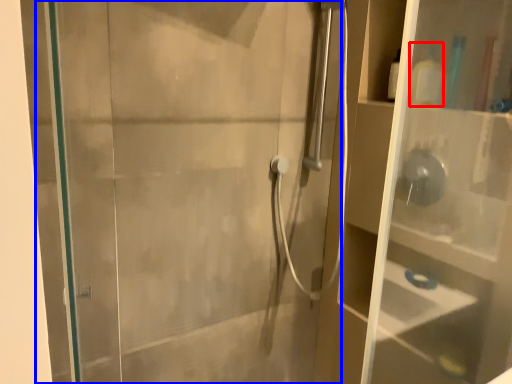
Question: Which object appears closest to the camera in this image, toiletry (highlighted by a red box) or screen door (highlighted by a blue box)?

Choices:
 (A) toiletry
 (B) screen door

Answer: (B)